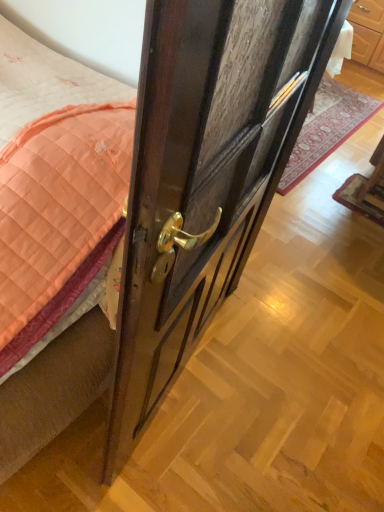
The height and width of the screenshot is (512, 384). I want to click on vacant space underneath wooden chair at lower right (from a real-world perspective), so click(x=371, y=197).